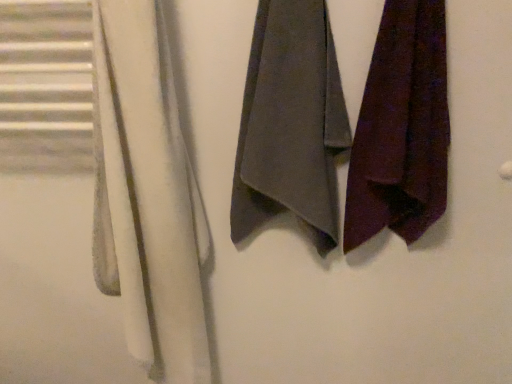
Question: Do you think dark purple fabric at right, the first towel when ordered from right to left, is within white soft towel at left, or outside of it?

Choices:
 (A) inside
 (B) outside

Answer: (B)

Question: Looking at the image, does dark purple fabric at right, the first towel when ordered from right to left, seem bigger or smaller compared to white soft towel at left?

Choices:
 (A) big
 (B) small

Answer: (B)

Question: Which object is positioned farthest from the dark purple fabric at right, the first towel when ordered from right to left?

Choices:
 (A) white soft towel at left
 (B) dark gray fabric towel at center, which ranks as the first towel in left-to-right order

Answer: (A)

Question: Which object is the closest to the white soft towel at left?

Choices:
 (A) dark purple fabric at right, the second towel positioned from the left
 (B) dark gray fabric towel at center, arranged as the 2th towel when viewed from the right

Answer: (B)